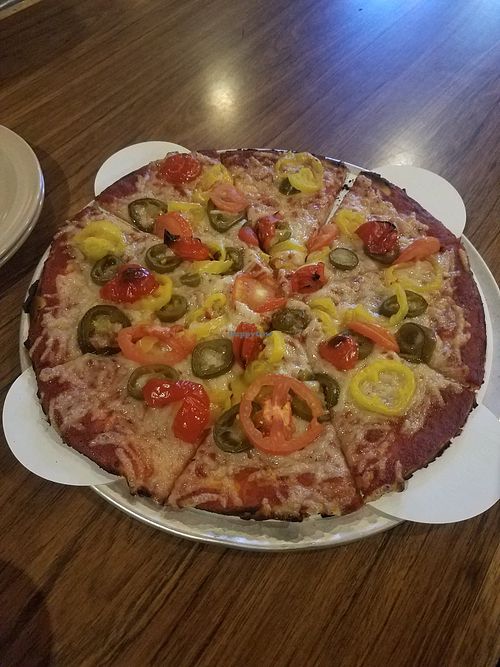
Identify the location of reflection on table from light. Image resolution: width=500 pixels, height=667 pixels. (219, 85), (397, 153), (379, 9), (478, 23).